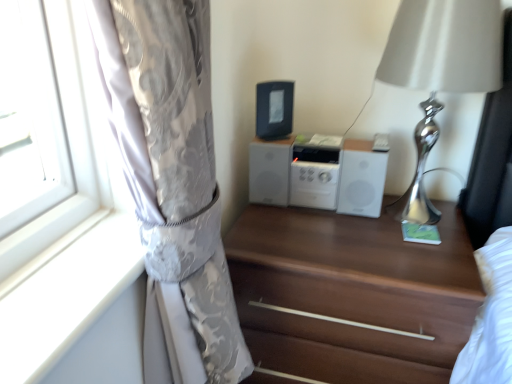
The height and width of the screenshot is (384, 512). Identify the location of vacant position to the left of silver metallic table lamp at right. (318, 240).